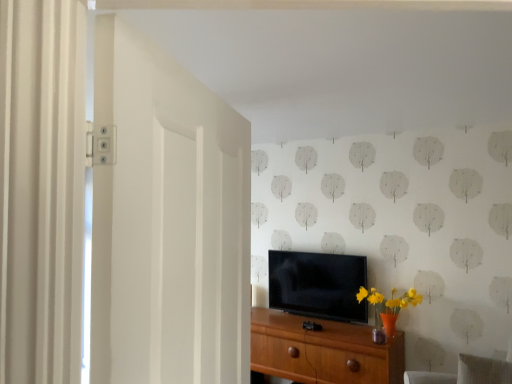
Image resolution: width=512 pixels, height=384 pixels. Find the location of `vacant space in front of black glossy tv at center`. vacant space in front of black glossy tv at center is located at coordinates (326, 320).